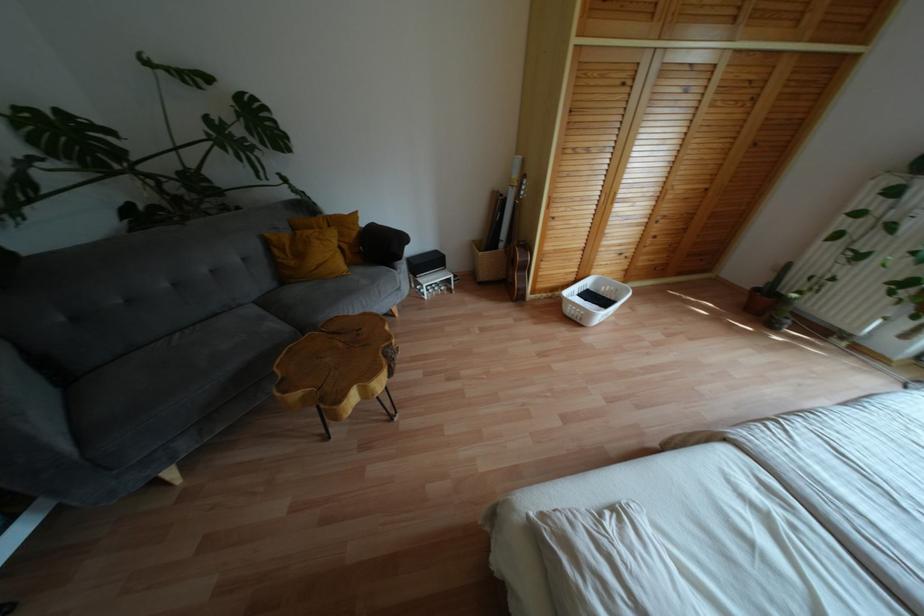
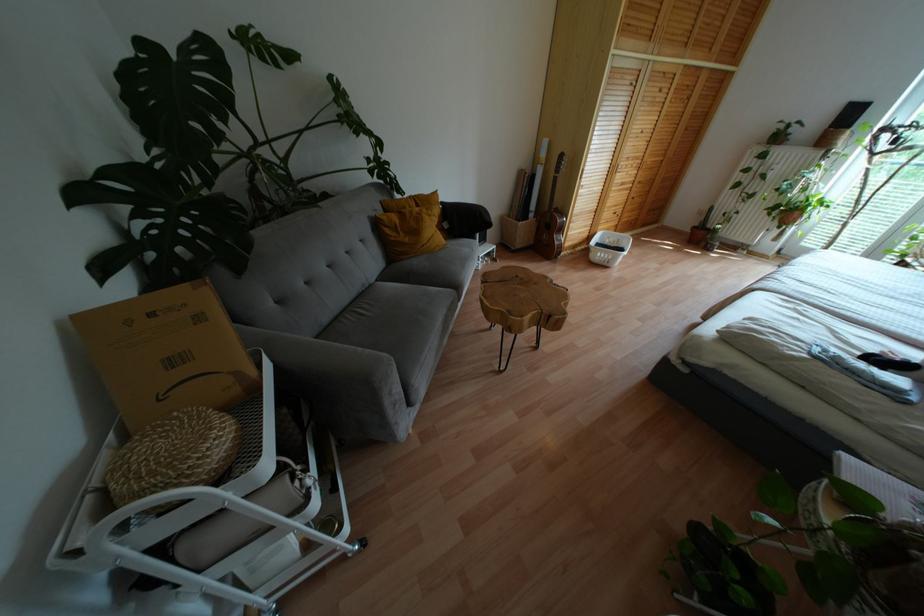
Question: I am providing you with two images of the same scene from different viewpoints. Which of the following objects are not visible in image2?

Choices:
 (A) white cart handle
 (B) cardboard mailer
 (C) brown plant pot
 (D) none of these

Answer: (D)